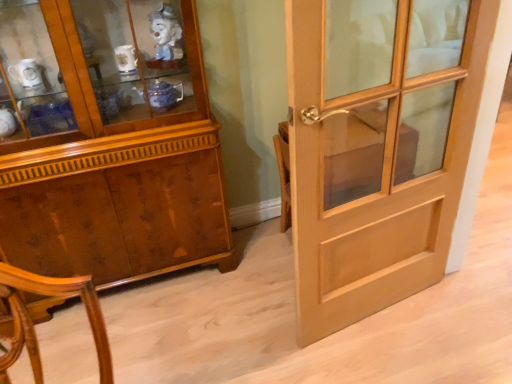
Question: Considering the relative sizes of wooden cabinet at left and light brown wood door at right in the image provided, is wooden cabinet at left shorter than light brown wood door at right?

Choices:
 (A) yes
 (B) no

Answer: (B)

Question: From the image's perspective, would you say wooden cabinet at left is positioned over light brown wood door at right?

Choices:
 (A) yes
 (B) no

Answer: (A)

Question: Is wooden cabinet at left wider than light brown wood door at right?

Choices:
 (A) no
 (B) yes

Answer: (B)

Question: Is the position of wooden cabinet at left more distant than that of light brown wood door at right?

Choices:
 (A) no
 (B) yes

Answer: (B)

Question: Considering the relative sizes of wooden cabinet at left and light brown wood door at right in the image provided, is wooden cabinet at left bigger than light brown wood door at right?

Choices:
 (A) no
 (B) yes

Answer: (B)

Question: Is wooden cabinet at left smaller than light brown wood door at right?

Choices:
 (A) yes
 (B) no

Answer: (B)

Question: From a real-world perspective, is light brown wood door at right under wooden cabinet at left?

Choices:
 (A) yes
 (B) no

Answer: (A)

Question: Does light brown wood door at right have a lesser height compared to wooden cabinet at left?

Choices:
 (A) no
 (B) yes

Answer: (B)

Question: From a real-world perspective, is light brown wood door at right on top of wooden cabinet at left?

Choices:
 (A) yes
 (B) no

Answer: (B)

Question: From the image's perspective, does light brown wood door at right appear higher than wooden cabinet at left?

Choices:
 (A) no
 (B) yes

Answer: (A)

Question: Does light brown wood door at right come behind wooden cabinet at left?

Choices:
 (A) yes
 (B) no

Answer: (B)

Question: Is light brown wood door at right located outside wooden cabinet at left?

Choices:
 (A) no
 (B) yes

Answer: (B)

Question: Is wooden cabinet at left inside the boundaries of light brown wood door at right, or outside?

Choices:
 (A) inside
 (B) outside

Answer: (B)